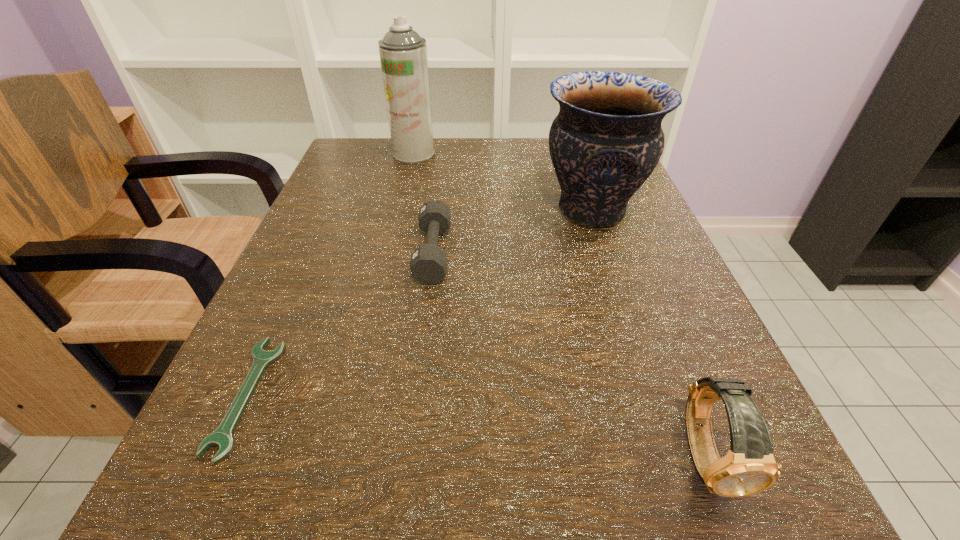
You are a GUI agent. You are given a task and a screenshot of the screen. Output one action in this format:
    pyautogui.click(x=<x>, y=<y>)
    Task: Click on the free space between the tallest object and the watch
    The image size is (960, 540).
    Given the screenshot: What is the action you would take?
    pyautogui.click(x=560, y=305)

Image resolution: width=960 pixels, height=540 pixels. Identify the location of unoccupied area between the leftmost object and the dumbbell. (340, 324).

The image size is (960, 540). What are the coordinates of `free space between the fourth tallest object and the pottery` in the screenshot? It's located at (513, 232).

In order to click on vacant area that lies between the pottery and the wrench in this screenshot , I will do `click(420, 303)`.

What are the coordinates of `free space between the aerosol can and the dumbbell` in the screenshot? It's located at (423, 203).

At what (x,y) coordinates should I click in order to perform the action: click on free space between the third tallest object and the aerosol can. Please return your answer as a coordinate pair (x, y). Looking at the image, I should click on (560, 305).

Where is `free space between the third shortest object and the shortest object`? This screenshot has height=540, width=960. free space between the third shortest object and the shortest object is located at coordinates (476, 426).

Where is `vacant area that lies between the watch and the second shortest object`? This screenshot has height=540, width=960. vacant area that lies between the watch and the second shortest object is located at coordinates (569, 354).

This screenshot has height=540, width=960. Identify the location of free point between the second shortest object and the third shortest object. (569, 354).

This screenshot has width=960, height=540. I want to click on vacant area that lies between the third tallest object and the tallest object, so click(x=560, y=305).